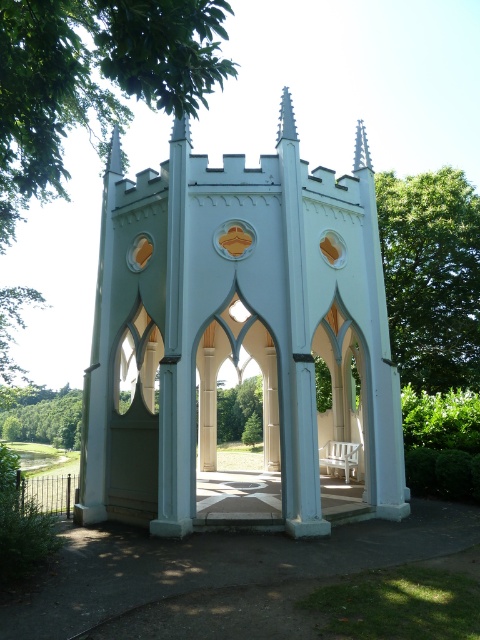
Question: Can you confirm if green leafy tree at upper right is thinner than green leafy tree at lower left?

Choices:
 (A) no
 (B) yes

Answer: (B)

Question: Is green leafy tree at upper center bigger than green leafy tree at upper right?

Choices:
 (A) yes
 (B) no

Answer: (A)

Question: Does white smooth gazebo at center come behind green leafy tree at lower left?

Choices:
 (A) no
 (B) yes

Answer: (A)

Question: Considering the real-world distances, which object is closest to the green leafy tree at upper center?

Choices:
 (A) green leafy tree at lower left
 (B) green leafy tree at upper right

Answer: (B)

Question: Which point is closer to the camera?

Choices:
 (A) click(17, 420)
 (B) click(215, 282)
 (C) click(51, 49)
 (D) click(435, 253)

Answer: (C)

Question: Which object appears farthest from the camera in this image?

Choices:
 (A) white smooth gazebo at center
 (B) green leafy tree at lower left
 (C) green leafy tree at upper center

Answer: (B)